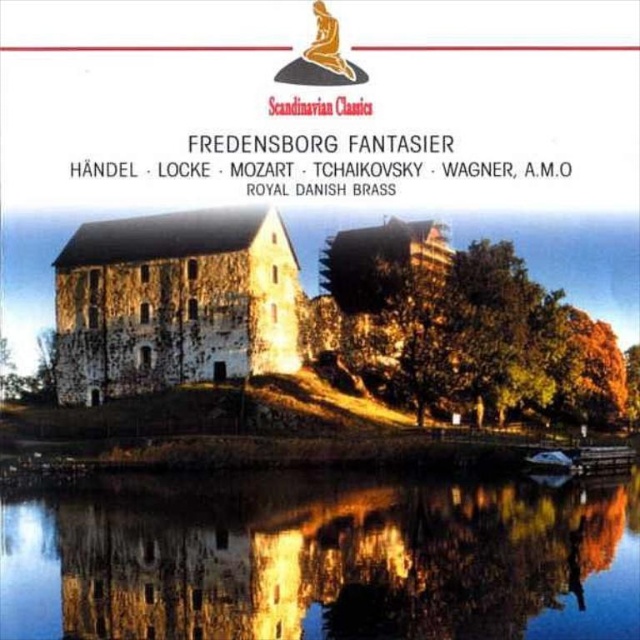
Is transparent glass water at lower center taller than stone textured castle at center?

Incorrect, transparent glass water at lower center's height is not larger of stone textured castle at center's.

Who is more distant from viewer, (557, 596) or (129, 346)?

Point (129, 346)

Between point (637, 579) and point (131, 285), which one is positioned in front?

Point (637, 579) is more forward.

Where is `transparent glass water at lower center`? This screenshot has width=640, height=640. transparent glass water at lower center is located at coordinates (324, 561).